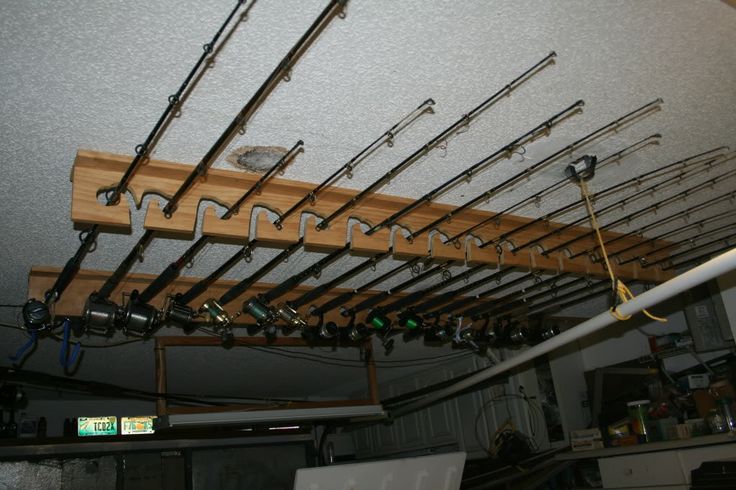
Find the location of `ceiling`. ceiling is located at coordinates (82, 58).